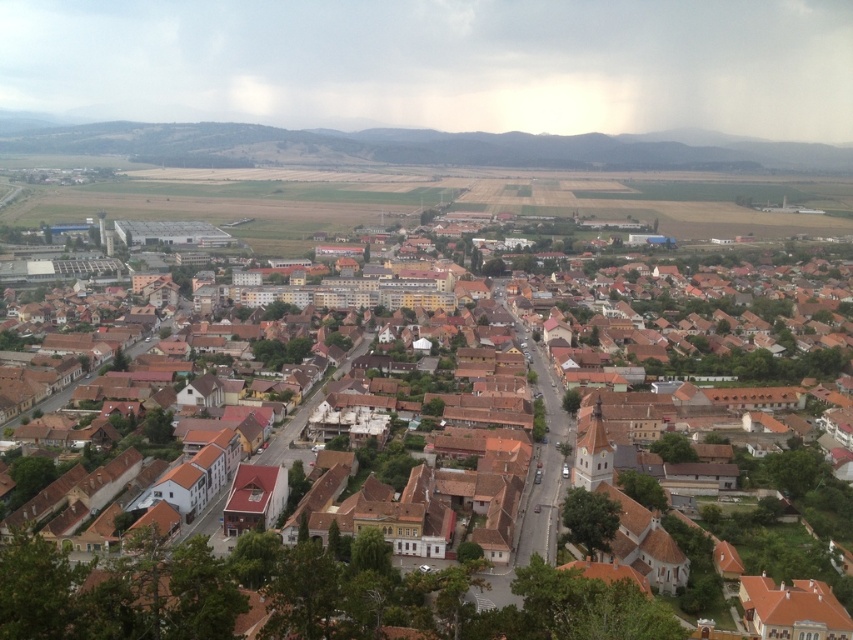
Is brown tiled roofs at center smaller than green grassy hill at upper center?

Yes, brown tiled roofs at center is smaller than green grassy hill at upper center.

Who is higher up, brown tiled roofs at center or green grassy hill at upper center?

Positioned higher is green grassy hill at upper center.

You are a GUI agent. You are given a task and a screenshot of the screen. Output one action in this format:
    pyautogui.click(x=<x>, y=<y>)
    Task: Click on the brown tiled roofs at center
    
    Given the screenshot: What is the action you would take?
    pyautogui.click(x=306, y=593)